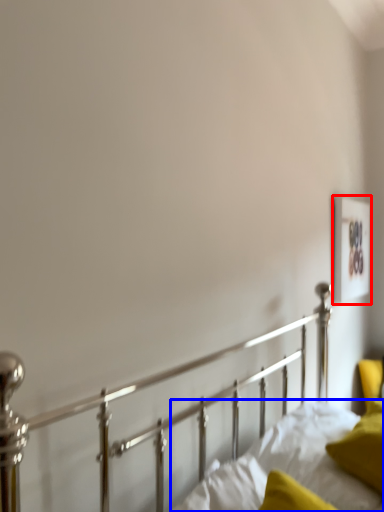
Question: Among these objects, which one is nearest to the camera, picture frame (highlighted by a red box) or mattress (highlighted by a blue box)?

Choices:
 (A) picture frame
 (B) mattress

Answer: (B)